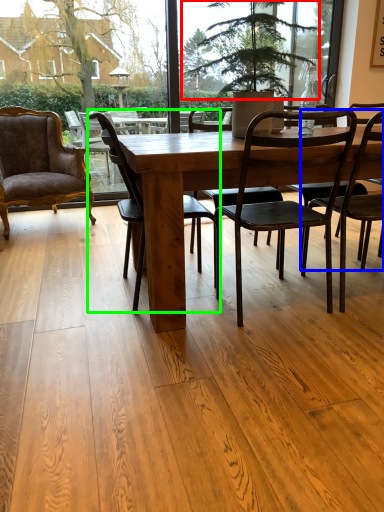
Question: Estimate the real-world distances between objects in this image. Which object is farther from tree (highlighted by a red box), chair (highlighted by a blue box) or chair (highlighted by a green box)?

Choices:
 (A) chair
 (B) chair

Answer: (B)